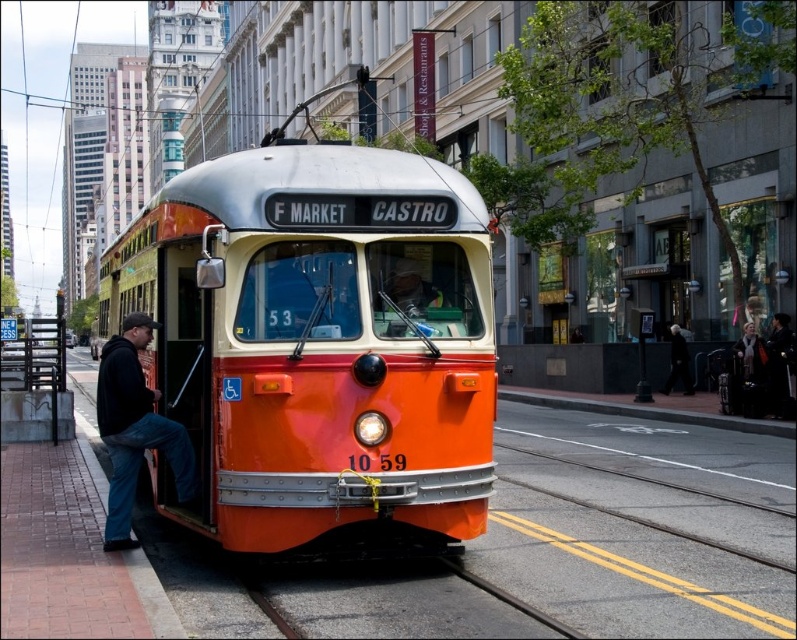
Question: Among these points, which one is farthest from the camera?

Choices:
 (A) (772, 372)
 (B) (664, 392)

Answer: (B)

Question: Which is farther from the white scarf at center?

Choices:
 (A) black leather jacket at center
 (B) brushed metal bus stop at lower left
 (C) black cotton jacket at left

Answer: (B)

Question: From the image, what is the correct spatial relationship of black cotton jacket at left in relation to black leather coat at right?

Choices:
 (A) above
 (B) below

Answer: (A)

Question: Which object is farther from the camera taking this photo?

Choices:
 (A) brushed metal bus stop at lower left
 (B) black leather jacket at center
 (C) white scarf at center
 (D) black cotton jacket at left

Answer: (B)

Question: Is metallic track at center further to camera compared to white scarf at center?

Choices:
 (A) yes
 (B) no

Answer: (B)

Question: Is metallic track at center thinner than white scarf at center?

Choices:
 (A) no
 (B) yes

Answer: (A)